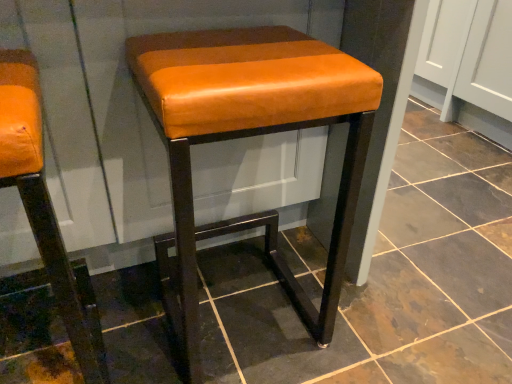
In order to face orange leather stool at left, the second stool in the right-to-left sequence, should I rotate leftwards or rightwards?

Rotate left and turn 29.966 degrees.

Find the location of a particular element. orange leather stool at left, the first stool in the left-to-right sequence is located at coordinates (42, 203).

The image size is (512, 384). What do you see at coordinates (42, 203) in the screenshot? I see `orange leather stool at left, the first stool in the left-to-right sequence` at bounding box center [42, 203].

Describe the element at coordinates (250, 136) in the screenshot. This screenshot has height=384, width=512. I see `matte orange leather stool at center, marked as the first stool in a right-to-left arrangement` at that location.

Find the location of a particular element. This screenshot has width=512, height=384. matte orange leather stool at center, marked as the first stool in a right-to-left arrangement is located at coordinates (250, 136).

Locate an element on the screen. orange leather stool at left, the second stool in the right-to-left sequence is located at coordinates (42, 203).

Can you confirm if matte orange leather stool at center, which appears as the 2th stool when viewed from the left, is positioned to the left of orange leather stool at left, the first stool in the left-to-right sequence?

No.

Is matte orange leather stool at center, which appears as the 2th stool when viewed from the left, further to the viewer compared to orange leather stool at left, the second stool in the right-to-left sequence?

Yes, matte orange leather stool at center, which appears as the 2th stool when viewed from the left, is further from the viewer.

Which is nearer, (319, 321) or (41, 134)?

Point (319, 321).

From the image's perspective, is matte orange leather stool at center, which appears as the 2th stool when viewed from the left, above orange leather stool at left, the second stool in the right-to-left sequence?

Correct, matte orange leather stool at center, which appears as the 2th stool when viewed from the left, appears higher than orange leather stool at left, the second stool in the right-to-left sequence, in the image.

From a real-world perspective, is matte orange leather stool at center, which appears as the 2th stool when viewed from the left, positioned under orange leather stool at left, the second stool in the right-to-left sequence, based on gravity?

Incorrect, from a real-world perspective, matte orange leather stool at center, which appears as the 2th stool when viewed from the left, is higher than orange leather stool at left, the second stool in the right-to-left sequence.

Considering the relative sizes of matte orange leather stool at center, marked as the first stool in a right-to-left arrangement, and orange leather stool at left, the first stool in the left-to-right sequence, in the image provided, is matte orange leather stool at center, marked as the first stool in a right-to-left arrangement, thinner than orange leather stool at left, the first stool in the left-to-right sequence,?

No, matte orange leather stool at center, marked as the first stool in a right-to-left arrangement, is not thinner than orange leather stool at left, the first stool in the left-to-right sequence.

Can you confirm if matte orange leather stool at center, which appears as the 2th stool when viewed from the left, is taller than orange leather stool at left, the second stool in the right-to-left sequence?

No, matte orange leather stool at center, which appears as the 2th stool when viewed from the left, is not taller than orange leather stool at left, the second stool in the right-to-left sequence.

Who is smaller, matte orange leather stool at center, which appears as the 2th stool when viewed from the left, or orange leather stool at left, the first stool in the left-to-right sequence?

With smaller size is orange leather stool at left, the first stool in the left-to-right sequence.

Can orange leather stool at left, the second stool in the right-to-left sequence, be found inside matte orange leather stool at center, which appears as the 2th stool when viewed from the left?

No, orange leather stool at left, the second stool in the right-to-left sequence, is not a part of matte orange leather stool at center, which appears as the 2th stool when viewed from the left.

Is the surface of matte orange leather stool at center, marked as the first stool in a right-to-left arrangement, in direct contact with orange leather stool at left, the second stool in the right-to-left sequence?

No, matte orange leather stool at center, marked as the first stool in a right-to-left arrangement, is not making contact with orange leather stool at left, the second stool in the right-to-left sequence.

Is matte orange leather stool at center, marked as the first stool in a right-to-left arrangement, positioned with its back to orange leather stool at left, the second stool in the right-to-left sequence?

That's not correct — matte orange leather stool at center, marked as the first stool in a right-to-left arrangement, is not looking away from orange leather stool at left, the second stool in the right-to-left sequence.

What's the angular difference between matte orange leather stool at center, marked as the first stool in a right-to-left arrangement, and orange leather stool at left, the second stool in the right-to-left sequence,'s facing directions?

The facing directions of matte orange leather stool at center, marked as the first stool in a right-to-left arrangement, and orange leather stool at left, the second stool in the right-to-left sequence, are 2.26 degrees apart.

Locate an element on the screen. stool that appears above the orange leather stool at left, the second stool in the right-to-left sequence (from a real-world perspective) is located at coordinates 250,136.

Is orange leather stool at left, the first stool in the left-to-right sequence, at the right side of matte orange leather stool at center, marked as the first stool in a right-to-left arrangement?

Incorrect, orange leather stool at left, the first stool in the left-to-right sequence, is not on the right side of matte orange leather stool at center, marked as the first stool in a right-to-left arrangement.

Between orange leather stool at left, the second stool in the right-to-left sequence, and matte orange leather stool at center, marked as the first stool in a right-to-left arrangement, which one is positioned in front?

Positioned in front is orange leather stool at left, the second stool in the right-to-left sequence.

Which is less distant, (85, 373) or (243, 130)?

The point (243, 130) is closer.

From the image's perspective, is orange leather stool at left, the first stool in the left-to-right sequence, beneath matte orange leather stool at center, marked as the first stool in a right-to-left arrangement?

Correct, orange leather stool at left, the first stool in the left-to-right sequence, appears lower than matte orange leather stool at center, marked as the first stool in a right-to-left arrangement, in the image.

From a real-world perspective, between orange leather stool at left, the first stool in the left-to-right sequence, and matte orange leather stool at center, marked as the first stool in a right-to-left arrangement, who is vertically lower?

orange leather stool at left, the first stool in the left-to-right sequence, from a real-world perspective.

Considering the sizes of objects orange leather stool at left, the first stool in the left-to-right sequence, and matte orange leather stool at center, marked as the first stool in a right-to-left arrangement, in the image provided, who is thinner, orange leather stool at left, the first stool in the left-to-right sequence, or matte orange leather stool at center, marked as the first stool in a right-to-left arrangement,?

orange leather stool at left, the first stool in the left-to-right sequence.

From their relative heights in the image, would you say orange leather stool at left, the second stool in the right-to-left sequence, is taller or shorter than matte orange leather stool at center, marked as the first stool in a right-to-left arrangement?

Clearly, orange leather stool at left, the second stool in the right-to-left sequence, is taller compared to matte orange leather stool at center, marked as the first stool in a right-to-left arrangement.

Is orange leather stool at left, the first stool in the left-to-right sequence, bigger than matte orange leather stool at center, which appears as the 2th stool when viewed from the left?

No.

Looking at this image, is orange leather stool at left, the first stool in the left-to-right sequence, inside or outside of matte orange leather stool at center, marked as the first stool in a right-to-left arrangement?

orange leather stool at left, the first stool in the left-to-right sequence, lies outside matte orange leather stool at center, marked as the first stool in a right-to-left arrangement.

Is orange leather stool at left, the second stool in the right-to-left sequence, in contact with matte orange leather stool at center, which appears as the 2th stool when viewed from the left?

No, orange leather stool at left, the second stool in the right-to-left sequence, is not with matte orange leather stool at center, which appears as the 2th stool when viewed from the left.

Is matte orange leather stool at center, marked as the first stool in a right-to-left arrangement, at the back of orange leather stool at left, the second stool in the right-to-left sequence?

No.

From the picture: How different are the orientations of orange leather stool at left, the second stool in the right-to-left sequence, and matte orange leather stool at center, which appears as the 2th stool when viewed from the left, in degrees?

2.26 degrees separate the facing orientations of orange leather stool at left, the second stool in the right-to-left sequence, and matte orange leather stool at center, which appears as the 2th stool when viewed from the left.

Consider the image. Measure the distance from orange leather stool at left, the first stool in the left-to-right sequence, to matte orange leather stool at center, marked as the first stool in a right-to-left arrangement.

orange leather stool at left, the first stool in the left-to-right sequence, and matte orange leather stool at center, marked as the first stool in a right-to-left arrangement, are 11.90 inches apart.

This screenshot has width=512, height=384. I want to click on stool on the left of the matte orange leather stool at center, which appears as the 2th stool when viewed from the left, so click(42, 203).

Locate an element on the screen. This screenshot has height=384, width=512. stool below the matte orange leather stool at center, marked as the first stool in a right-to-left arrangement (from the image's perspective) is located at coordinates (42, 203).

The height and width of the screenshot is (384, 512). What are the coordinates of `stool located in front of the matte orange leather stool at center, which appears as the 2th stool when viewed from the left` in the screenshot? It's located at (42, 203).